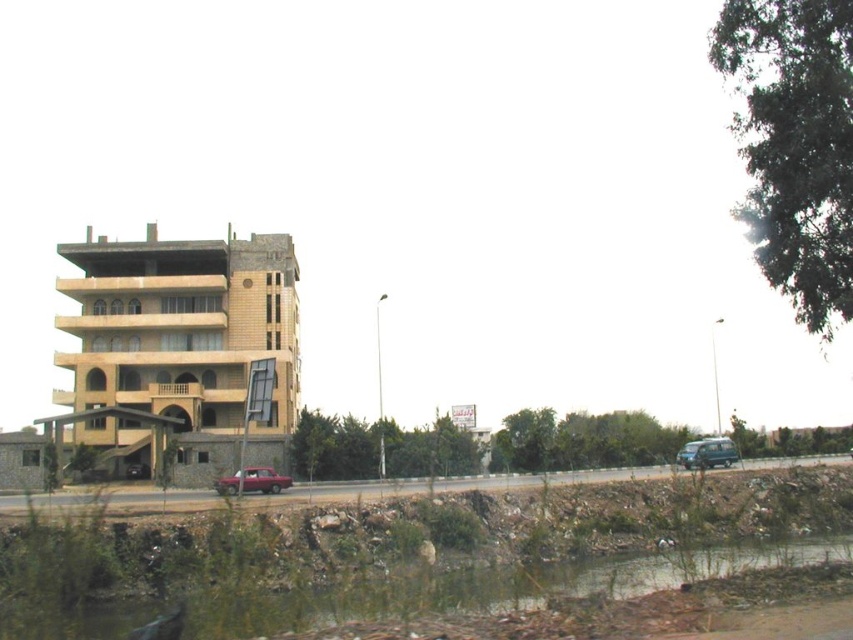
Between brown dirt at lower left and matte red car at center, which one is positioned lower?

matte red car at center is lower down.

Image resolution: width=853 pixels, height=640 pixels. What do you see at coordinates (503, 586) in the screenshot?
I see `brown dirt at lower left` at bounding box center [503, 586].

Locate an element on the screen. Image resolution: width=853 pixels, height=640 pixels. brown dirt at lower left is located at coordinates (503, 586).

Can you confirm if brown dirt at lower left is positioned to the right of metallic blue van at lower right?

No, brown dirt at lower left is not to the right of metallic blue van at lower right.

Which is below, brown dirt at lower left or metallic blue van at lower right?

metallic blue van at lower right is lower down.

Who is more forward, (392, 596) or (703, 444)?

Positioned in front is point (392, 596).

The height and width of the screenshot is (640, 853). I want to click on brown dirt at lower left, so click(x=503, y=586).

Which is behind, point (718, 438) or point (230, 477)?

Point (718, 438)

Who is shorter, metallic blue van at lower right or matte red car at center?

metallic blue van at lower right is shorter.

This screenshot has width=853, height=640. What do you see at coordinates (706, 452) in the screenshot?
I see `metallic blue van at lower right` at bounding box center [706, 452].

You are a GUI agent. You are given a task and a screenshot of the screen. Output one action in this format:
    pyautogui.click(x=<x>, y=<y>)
    Task: Click on the metallic blue van at lower right
    
    Given the screenshot: What is the action you would take?
    pyautogui.click(x=706, y=452)